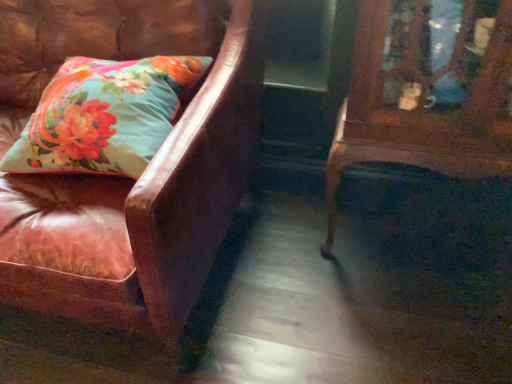
Question: From a real-world perspective, does floral fabric pillow at left stand above leather couch at left?

Choices:
 (A) yes
 (B) no

Answer: (A)

Question: Is floral fabric pillow at left positioned with its back to leather couch at left?

Choices:
 (A) yes
 (B) no

Answer: (A)

Question: From the image's perspective, would you say floral fabric pillow at left is positioned over leather couch at left?

Choices:
 (A) no
 (B) yes

Answer: (B)

Question: From a real-world perspective, is floral fabric pillow at left positioned under leather couch at left based on gravity?

Choices:
 (A) yes
 (B) no

Answer: (B)

Question: Can you confirm if floral fabric pillow at left is taller than leather couch at left?

Choices:
 (A) yes
 (B) no

Answer: (B)

Question: Is floral fabric pillow at left aimed at leather couch at left?

Choices:
 (A) yes
 (B) no

Answer: (A)

Question: Is mahogany wood side table at right wider than leather couch at left?

Choices:
 (A) yes
 (B) no

Answer: (B)

Question: Considering the relative positions of mahogany wood side table at right and leather couch at left in the image provided, is mahogany wood side table at right to the left of leather couch at left from the viewer's perspective?

Choices:
 (A) no
 (B) yes

Answer: (A)

Question: Can you confirm if mahogany wood side table at right is thinner than leather couch at left?

Choices:
 (A) no
 (B) yes

Answer: (B)

Question: Is mahogany wood side table at right in front of leather couch at left?

Choices:
 (A) yes
 (B) no

Answer: (B)

Question: Can you confirm if mahogany wood side table at right is bigger than leather couch at left?

Choices:
 (A) no
 (B) yes

Answer: (A)

Question: Would you say mahogany wood side table at right is outside leather couch at left?

Choices:
 (A) no
 (B) yes

Answer: (B)

Question: Is leather couch at left next to floral fabric pillow at left?

Choices:
 (A) no
 (B) yes

Answer: (A)